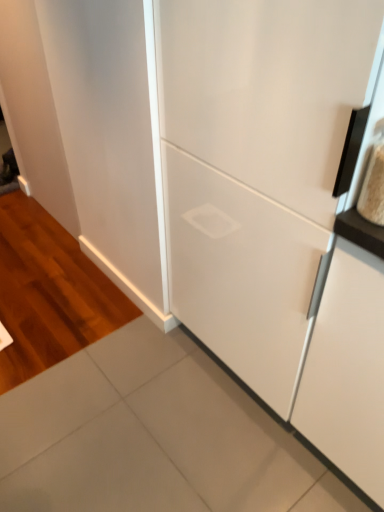
What is the approximate height of glossy white door at center?

It is 3.72 feet.

This screenshot has width=384, height=512. I want to click on glossy white door at center, so click(x=266, y=89).

What do you see at coordinates (266, 89) in the screenshot?
I see `glossy white door at center` at bounding box center [266, 89].

Where is `glossy white door at center`? glossy white door at center is located at coordinates (266, 89).